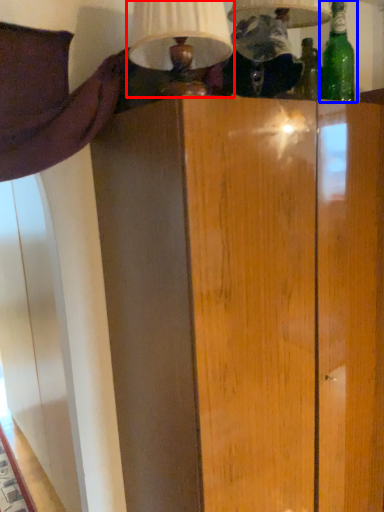
Question: Which point is further to the camera, table lamp (highlighted by a red box) or bottle (highlighted by a blue box)?

Choices:
 (A) table lamp
 (B) bottle

Answer: (B)